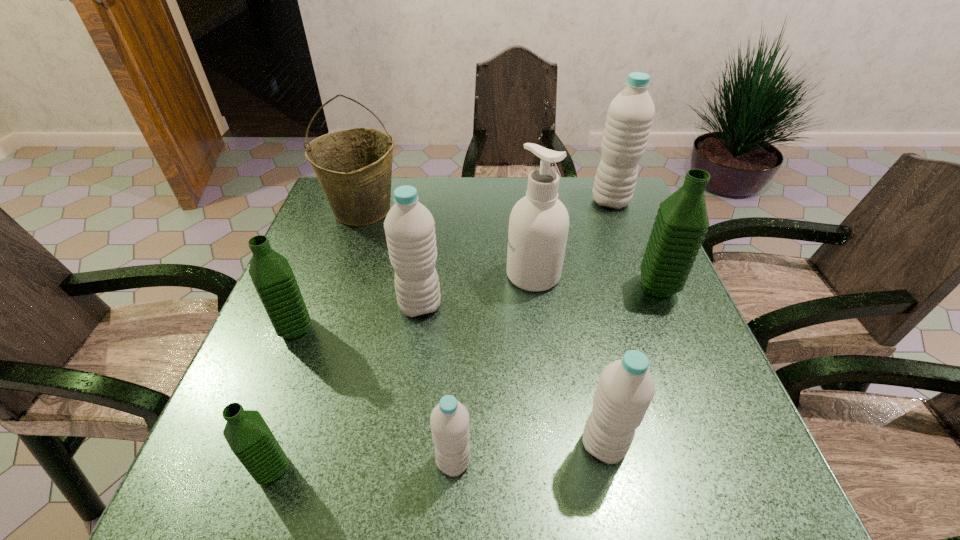
Locate an element on the screen. This screenshot has height=540, width=960. the tallest water bottle is located at coordinates (630, 114).

Where is `the rightmost white water bottle`? This screenshot has height=540, width=960. the rightmost white water bottle is located at coordinates (630, 114).

Find the location of a particular element. The width and height of the screenshot is (960, 540). wine bucket is located at coordinates (354, 167).

The width and height of the screenshot is (960, 540). What are the coordinates of `cleansing agent` in the screenshot? It's located at (539, 222).

This screenshot has width=960, height=540. Find the location of `the rightmost green water bottle`. the rightmost green water bottle is located at coordinates click(681, 223).

Locate an element on the screen. the biggest green water bottle is located at coordinates (681, 223).

The height and width of the screenshot is (540, 960). Find the location of `the third smallest white water bottle`. the third smallest white water bottle is located at coordinates (409, 226).

You are a GUI agent. You are given a task and a screenshot of the screen. Output one action in this format:
    pyautogui.click(x=<x>, y=<y>)
    Task: Click on the sixth object from right to left
    This screenshot has height=540, width=960.
    Given the screenshot: What is the action you would take?
    pyautogui.click(x=409, y=226)

This screenshot has width=960, height=540. I want to click on the second nearest green water bottle, so click(x=271, y=274).

Identify the location of the third white water bottle from left to right. The height and width of the screenshot is (540, 960). (626, 388).